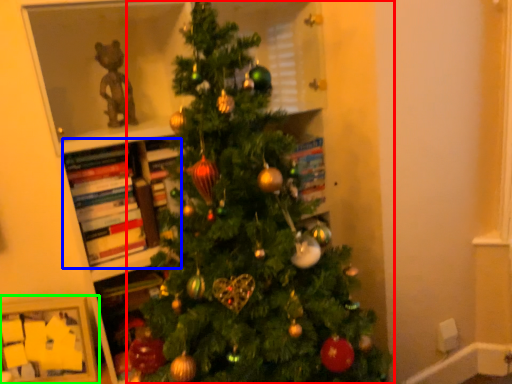
Question: Which object is the closest to the christmas tree (highlighted by a red box)? Choose among these: book (highlighted by a blue box) or picture frame (highlighted by a green box).

Choices:
 (A) book
 (B) picture frame

Answer: (A)